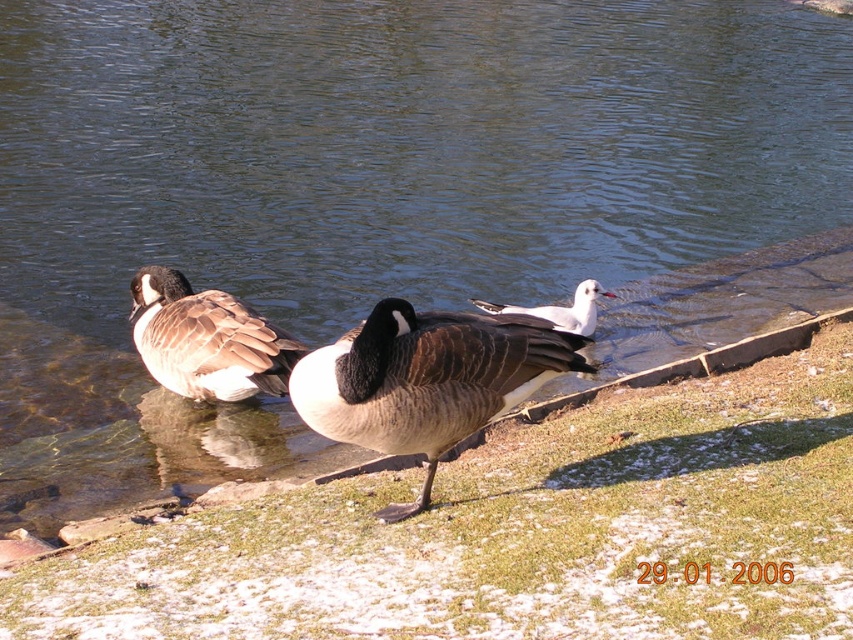
Question: From the image, what is the correct spatial relationship of green grass at center in relation to dark brown feathered duck at center?

Choices:
 (A) above
 (B) below

Answer: (B)

Question: Can you confirm if green grass at center is wider than dark brown feathered duck at center?

Choices:
 (A) no
 (B) yes

Answer: (B)

Question: Estimate the real-world distances between objects in this image. Which object is closer to the brown feathered goose at center?

Choices:
 (A) green grass at center
 (B) dark brown feathered duck at center
 (C) white glossy bird at center

Answer: (A)

Question: Among these objects, which one is nearest to the camera?

Choices:
 (A) green grass at center
 (B) dark brown feathered duck at center
 (C) brown feathered goose at center
 (D) white glossy bird at center

Answer: (A)

Question: Which point is farther to the camera?

Choices:
 (A) white glossy bird at center
 (B) dark brown feathered duck at center
 (C) green grass at center

Answer: (A)

Question: Where is dark brown feathered duck at center located in relation to brown feathered goose at center in the image?

Choices:
 (A) above
 (B) below

Answer: (B)